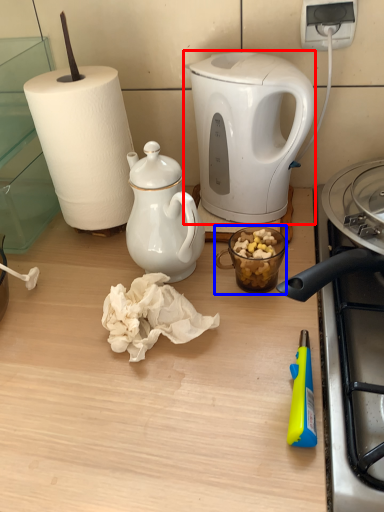
Question: Which of the following is the closest to the observer, kettle (highlighted by a red box) or coffee cup (highlighted by a blue box)?

Choices:
 (A) kettle
 (B) coffee cup

Answer: (B)